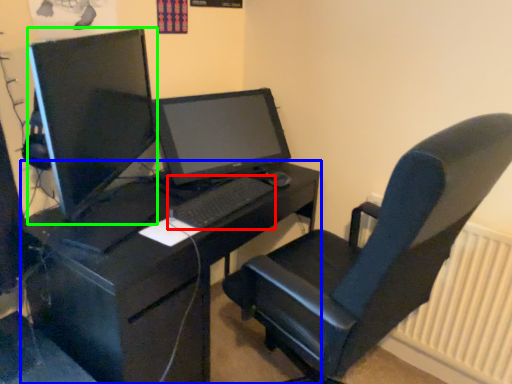
Question: Which object is positioned closest to computer keyboard (highlighted by a red box)? Select from desk (highlighted by a blue box) and computer monitor (highlighted by a green box).

Choices:
 (A) desk
 (B) computer monitor

Answer: (A)